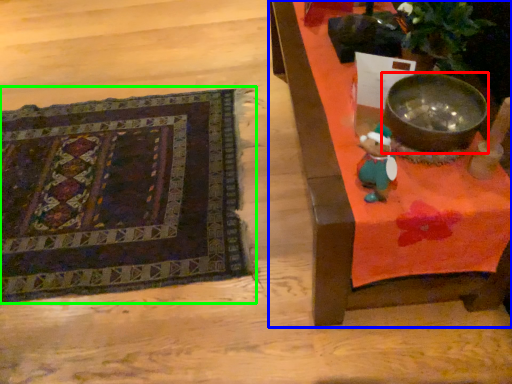
Question: Which is nearer to the mixing bowl (highlighted by a red box)? furniture (highlighted by a blue box) or mat (highlighted by a green box).

Choices:
 (A) furniture
 (B) mat

Answer: (A)